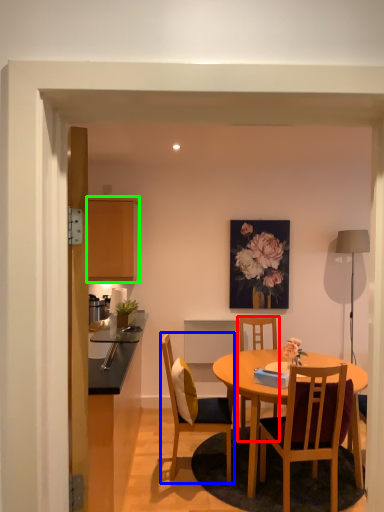
Question: Which object is the farthest from chair (highlighted by a red box)? Choose among these: chair (highlighted by a blue box) or cabinetry (highlighted by a green box).

Choices:
 (A) chair
 (B) cabinetry

Answer: (B)